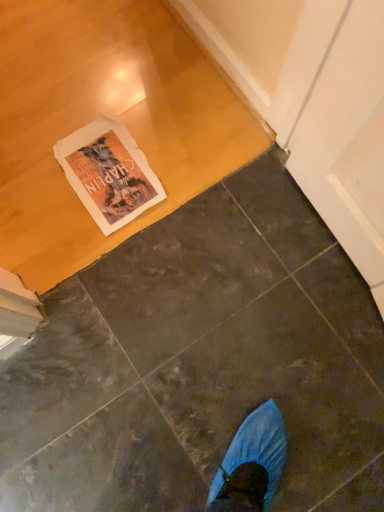
Locate an element on the screen. This screenshot has width=384, height=512. free spot to the left of white paper magazine at upper left is located at coordinates (21, 154).